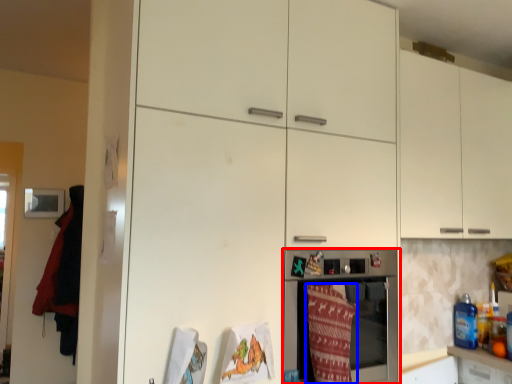
Question: Which point is closer to the camera, home appliance (highlighted by a red box) or blanket (highlighted by a blue box)?

Choices:
 (A) home appliance
 (B) blanket

Answer: (B)